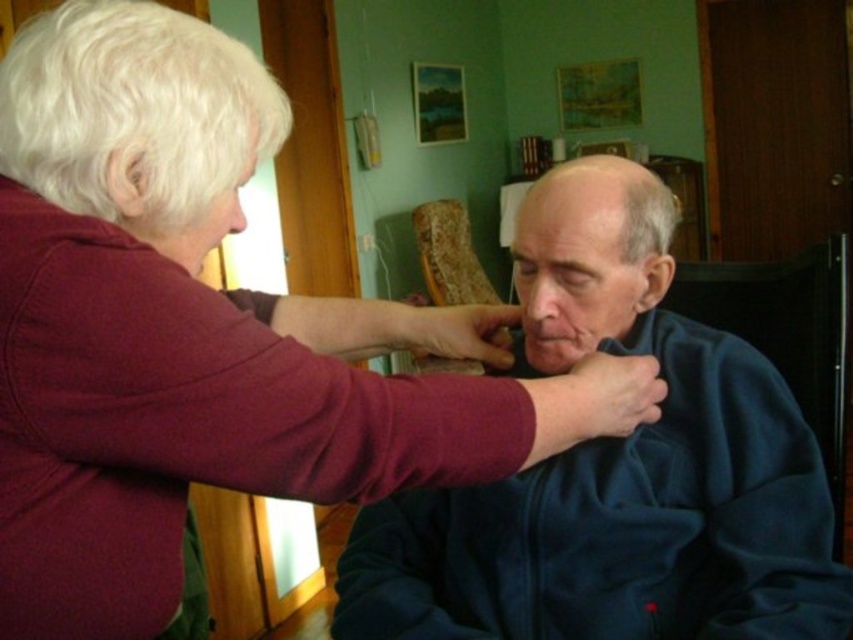
Does smooth bald head at center have a greater height compared to wooden textured chair at center?

In fact, smooth bald head at center may be shorter than wooden textured chair at center.

Which is behind, point (630, 212) or point (425, 209)?

Point (425, 209)

Does point (538, 202) come closer to viewer compared to point (456, 209)?

That is True.

This screenshot has width=853, height=640. In order to click on smooth bald head at center in this screenshot , I will do `click(583, 202)`.

In the scene shown: Who is higher up, dark blue fleece at center or white curly hair at upper left?

Positioned higher is white curly hair at upper left.

Measure the distance between point (566, 362) and camera.

Point (566, 362) is 3.37 feet from camera.

Locate an element on the screen. This screenshot has height=640, width=853. dark blue fleece at center is located at coordinates (618, 488).

Which is above, white curly hair at upper left or smooth bald head at center?

Positioned higher is white curly hair at upper left.

Locate an element on the screen. This screenshot has height=640, width=853. white curly hair at upper left is located at coordinates (132, 106).